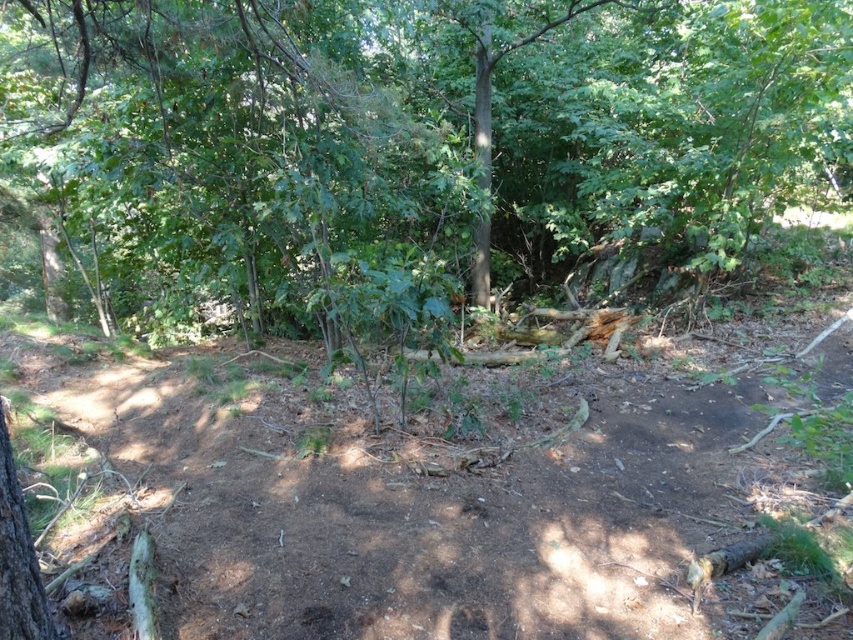
Which of these two, green leafy tree at center or brown dirt track at center, stands shorter?

Standing shorter between the two is green leafy tree at center.

Can you confirm if green leafy tree at center is positioned below brown dirt track at center?

Actually, green leafy tree at center is above brown dirt track at center.

Is point (26, 182) behind point (532, 419)?

Yes.

Find the location of a particular element. Image resolution: width=853 pixels, height=640 pixels. green leafy tree at center is located at coordinates (415, 145).